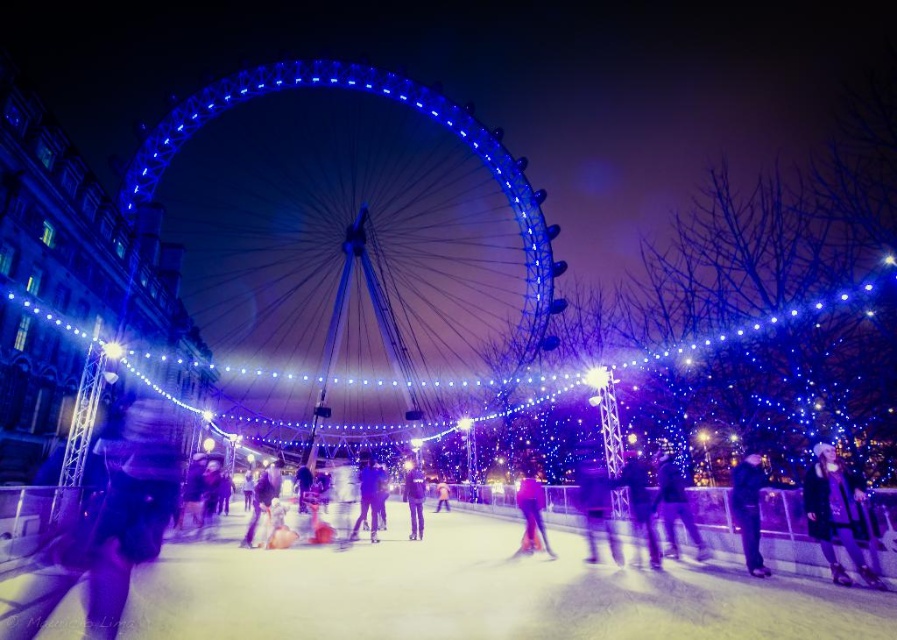
You are an event photographer at the ice skating rink. You want to take a photo of the matte pink pants at center and the pink fabric at center. Which object should you focus on first to ensure both are in sharp focus?

You should focus on the matte pink pants at center first since it is in front of the pink fabric at center, ensuring both will be in focus when focusing on the closer object.

You are standing at the Ferris wheel and want to reach the ice skating rink. There are two points marked on the path leading to the rink. Which point should you head towards if you want to take the shortest route to the rink? The two points are point (615, 538) and point (436, 496).

Point (615, 538) is closer to the viewer than point (436, 496), so you should head towards point (615, 538) to take the shortest route to the ice skating rink.